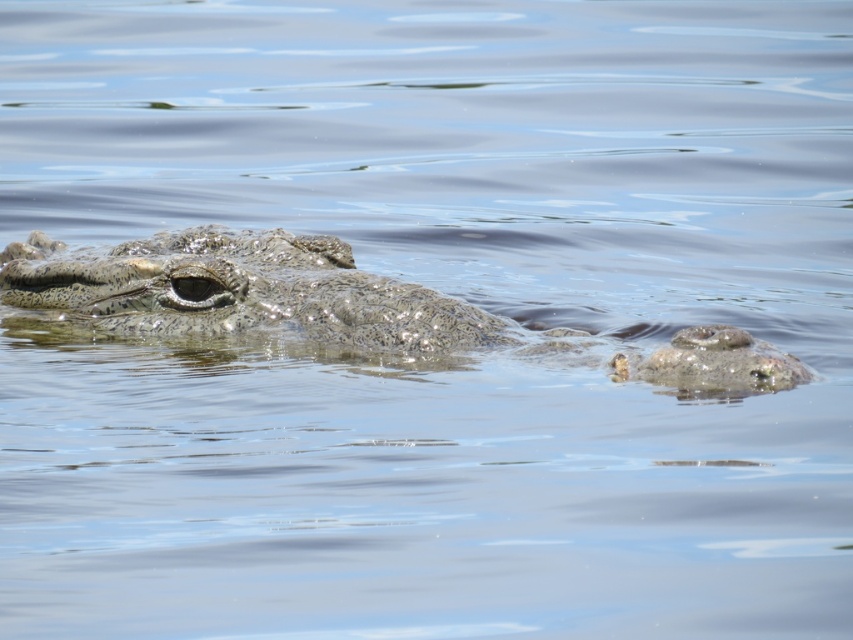
Is point (141, 301) more distant than point (705, 362)?

Yes, point (141, 301) is farther from viewer.

Can you confirm if speckled scaly crocodile at center is positioned to the left of gray textured rock at right?

Indeed, speckled scaly crocodile at center is positioned on the left side of gray textured rock at right.

Who is more forward, (320, 262) or (663, 364)?

Point (663, 364)

Locate an element on the screen. speckled scaly crocodile at center is located at coordinates (251, 292).